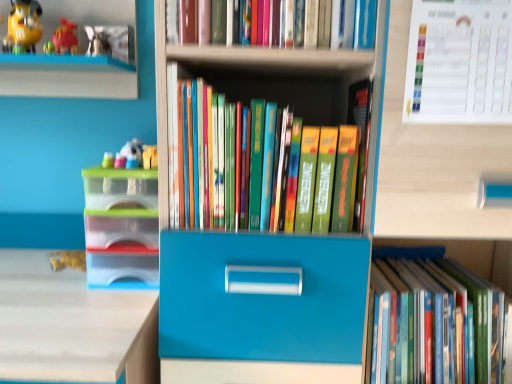
Question: In which direction should I rotate to look at hardcover books at center, the 2th book ordered from the bottom?

Choices:
 (A) right
 (B) left

Answer: (A)

Question: Which direction should I rotate to look at hardcover books at upper center, acting as the third book starting from the bottom, — up or down?

Choices:
 (A) up
 (B) down

Answer: (A)

Question: From a real-world perspective, is plastic toy at left, marked as the first toy in a right-to-left arrangement, on matte yellow toy at upper left, which is counted as the 2th toy, starting from the right?

Choices:
 (A) yes
 (B) no

Answer: (B)

Question: Is plastic toy at left, marked as the second toy in a top-to-bottom arrangement, to the right of matte yellow toy at upper left, arranged as the first toy when viewed from the top, from the viewer's perspective?

Choices:
 (A) yes
 (B) no

Answer: (A)

Question: Does plastic toy at left, which appears as the first toy when ordered from the bottom, lie behind matte yellow toy at upper left, positioned as the 2th toy in bottom-to-top order?

Choices:
 (A) yes
 (B) no

Answer: (A)

Question: Does plastic toy at left, marked as the first toy in a right-to-left arrangement, have a greater width compared to matte yellow toy at upper left, arranged as the first toy when viewed from the top?

Choices:
 (A) no
 (B) yes

Answer: (A)

Question: Is plastic toy at left, which is the second toy in left-to-right order, smaller than matte yellow toy at upper left, positioned as the 2th toy in bottom-to-top order?

Choices:
 (A) no
 (B) yes

Answer: (B)

Question: Is plastic toy at left, which appears as the first toy when ordered from the bottom, positioned before matte yellow toy at upper left, positioned as the 2th toy in bottom-to-top order?

Choices:
 (A) yes
 (B) no

Answer: (B)

Question: Does translucent plastic storage box at left have a lesser height compared to matte yellow toy at upper left, the 1th toy when ordered from left to right?

Choices:
 (A) yes
 (B) no

Answer: (B)

Question: Is translucent plastic storage box at left turned away from matte yellow toy at upper left, the 1th toy when ordered from left to right?

Choices:
 (A) yes
 (B) no

Answer: (B)

Question: Can you confirm if translucent plastic storage box at left is smaller than matte yellow toy at upper left, arranged as the first toy when viewed from the top?

Choices:
 (A) no
 (B) yes

Answer: (A)

Question: Does translucent plastic storage box at left appear on the left side of matte yellow toy at upper left, the 1th toy when ordered from left to right?

Choices:
 (A) no
 (B) yes

Answer: (A)

Question: Does translucent plastic storage box at left lie in front of matte yellow toy at upper left, positioned as the 2th toy in bottom-to-top order?

Choices:
 (A) no
 (B) yes

Answer: (B)

Question: Is translucent plastic storage box at left taller than matte yellow toy at upper left, positioned as the 2th toy in bottom-to-top order?

Choices:
 (A) no
 (B) yes

Answer: (B)

Question: Does hardcover book at lower right, positioned as the 1th book in bottom-to-top order, lie in front of white paper calendar at upper right?

Choices:
 (A) no
 (B) yes

Answer: (A)